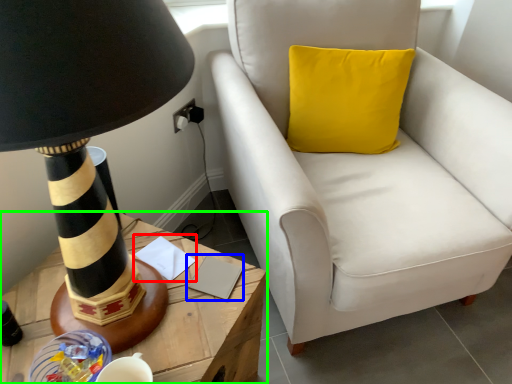
Question: Considering the real-world distances, which object is closest to notepad (highlighted by a red box)? notepad (highlighted by a blue box) or table (highlighted by a green box).

Choices:
 (A) notepad
 (B) table

Answer: (A)